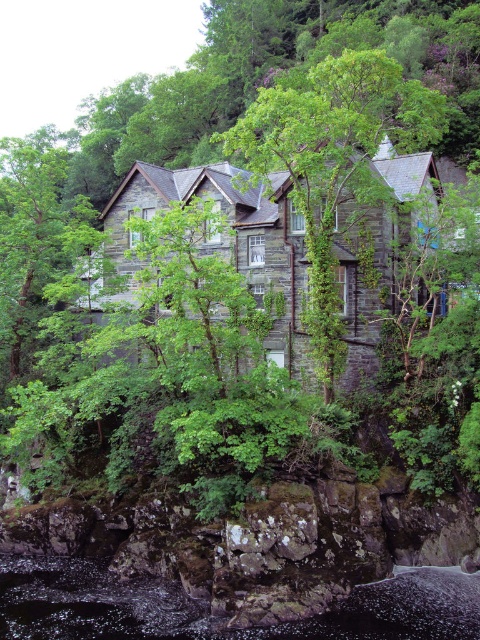
Question: Among these points, which one is nearest to the camera?

Choices:
 (A) (1, 248)
 (B) (302, 172)

Answer: (B)

Question: Is black liquid at lower center bigger than green leafy tree at left?

Choices:
 (A) yes
 (B) no

Answer: (B)

Question: Is green leafy tree at center to the right of black liquid at lower center from the viewer's perspective?

Choices:
 (A) no
 (B) yes

Answer: (B)

Question: Which point is farther to the camera?

Choices:
 (A) green leafy tree at left
 (B) black liquid at lower center
 (C) green leafy tree at center

Answer: (A)

Question: Which object is the farthest from the black liquid at lower center?

Choices:
 (A) green leafy tree at left
 (B) green leafy tree at center

Answer: (A)

Question: Does green leafy tree at center have a lesser width compared to black liquid at lower center?

Choices:
 (A) no
 (B) yes

Answer: (B)